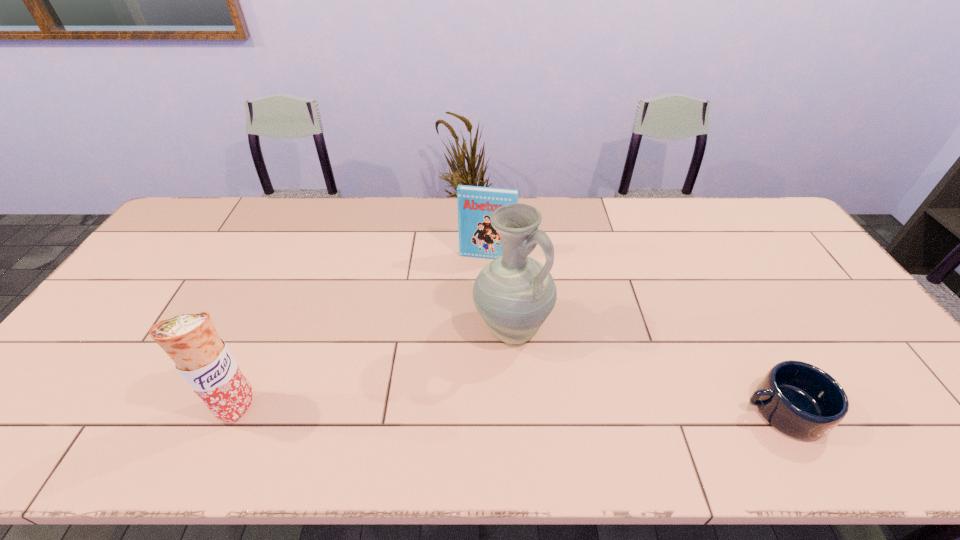
I want to click on vacant space on the desktop that is between the burrito and the rightmost object and is positioned on the front cover of the book, so click(455, 408).

This screenshot has height=540, width=960. In order to click on free space on the desktop that is between the burrito and the mug and is positioned on the handle side of the pitcher in this screenshot , I will do `click(559, 409)`.